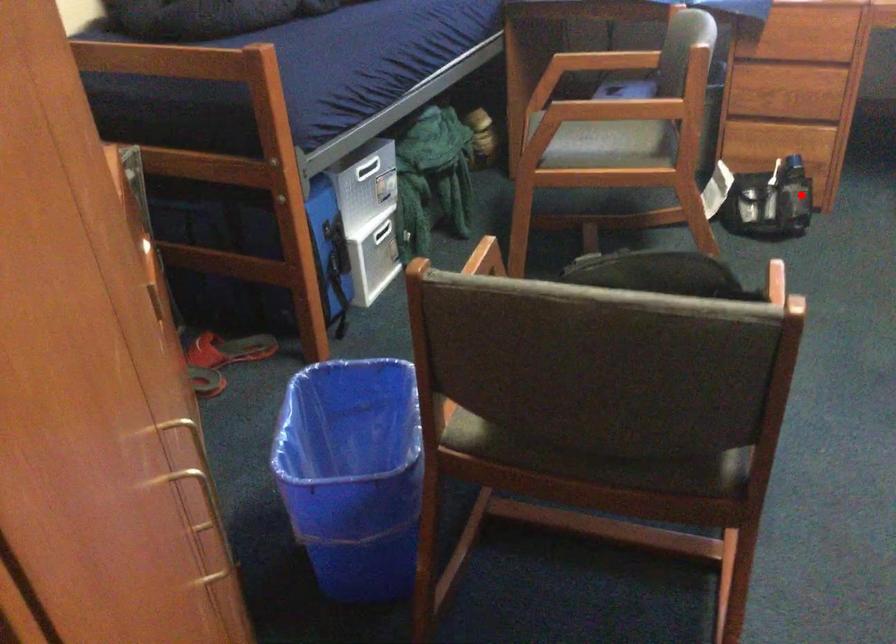
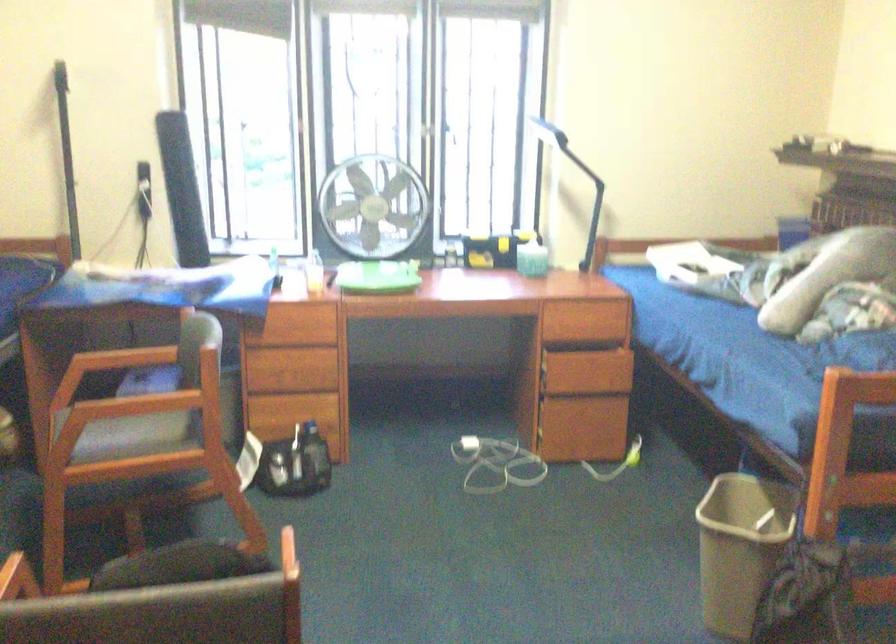
Question: I am providing you with two images of the same scene from different viewpoints. A red point is shown in image1. For the corresponding object point in image2, is it positioned nearer or farther from the camera?

Choices:
 (A) Nearer
 (B) Farther

Answer: (B)